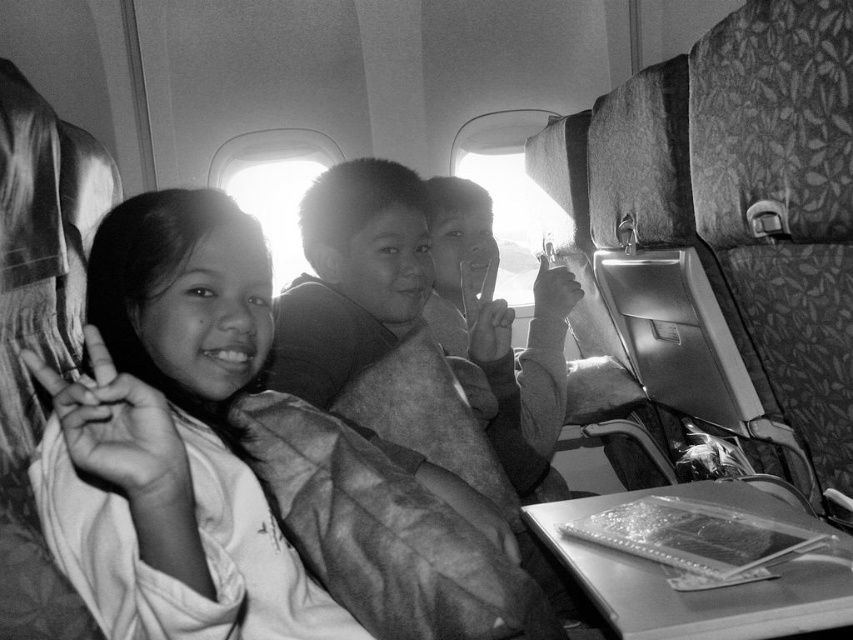
Question: Among these points, which one is nearest to the camera?

Choices:
 (A) (480, 198)
 (B) (184, 317)

Answer: (B)

Question: Which object appears closest to the camera in this image?

Choices:
 (A) smooth skin child at center
 (B) smooth fabric shirt at left

Answer: (B)

Question: Among these objects, which one is farthest from the camera?

Choices:
 (A) smooth fabric shirt at left
 (B) smooth skin child at center

Answer: (B)

Question: Does smooth fabric shirt at left have a lesser width compared to smooth skin child at center?

Choices:
 (A) yes
 (B) no

Answer: (A)

Question: Where is smooth fabric shirt at left located in relation to smooth skin child at center in the image?

Choices:
 (A) below
 (B) above

Answer: (A)

Question: Is smooth fabric shirt at left to the right of smooth skin child at center from the viewer's perspective?

Choices:
 (A) yes
 (B) no

Answer: (B)